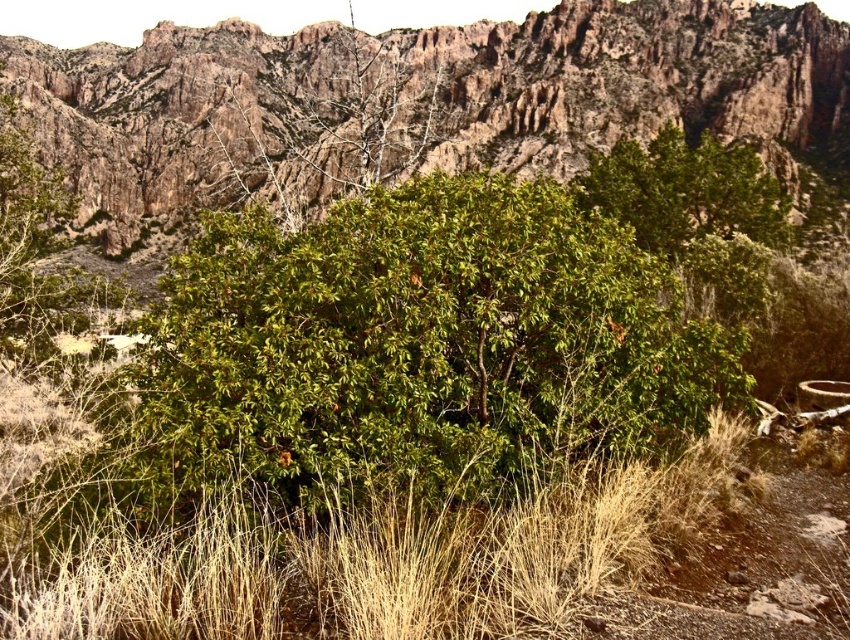
Question: Which point appears farthest from the camera in this image?

Choices:
 (A) (517, 410)
 (B) (536, 70)

Answer: (B)

Question: Considering the relative positions of green leafy bush at center and rugged rock mountain at center in the image provided, where is green leafy bush at center located with respect to rugged rock mountain at center?

Choices:
 (A) above
 (B) below

Answer: (B)

Question: Does green leafy bush at center appear on the left side of rugged rock mountain at center?

Choices:
 (A) yes
 (B) no

Answer: (B)

Question: Which of the following is the closest to the observer?

Choices:
 (A) (599, 380)
 (B) (638, 106)

Answer: (A)

Question: In this image, where is green leafy bush at center located relative to rugged rock mountain at center?

Choices:
 (A) above
 (B) below

Answer: (B)